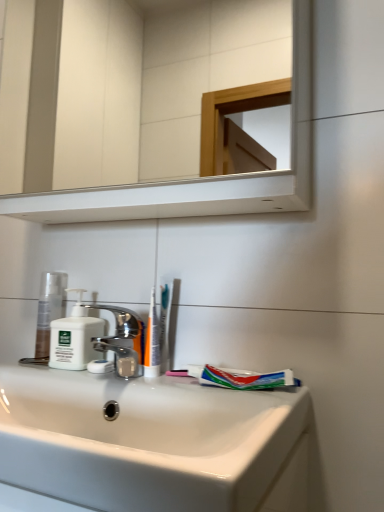
Where is `vacant area that is in front of white plastic toothbrush at center`? Image resolution: width=384 pixels, height=512 pixels. vacant area that is in front of white plastic toothbrush at center is located at coordinates (184, 391).